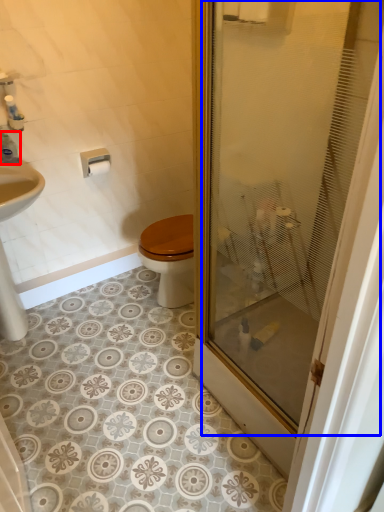
Question: Among these objects, which one is nearest to the camera, toiletry (highlighted by a red box) or glass door (highlighted by a blue box)?

Choices:
 (A) toiletry
 (B) glass door

Answer: (B)